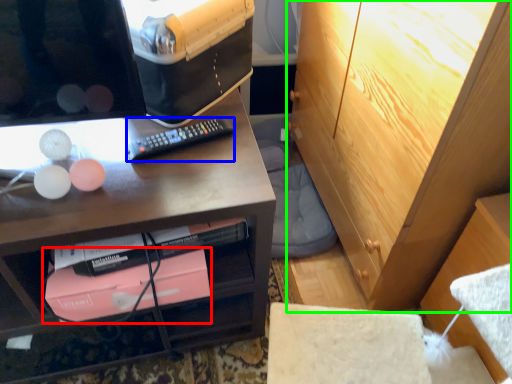
Question: Estimate the real-world distances between objects in this image. Which object is closer to book (highlighted by a red box), remote control (highlighted by a blue box) or cabinetry (highlighted by a green box)?

Choices:
 (A) remote control
 (B) cabinetry

Answer: (A)